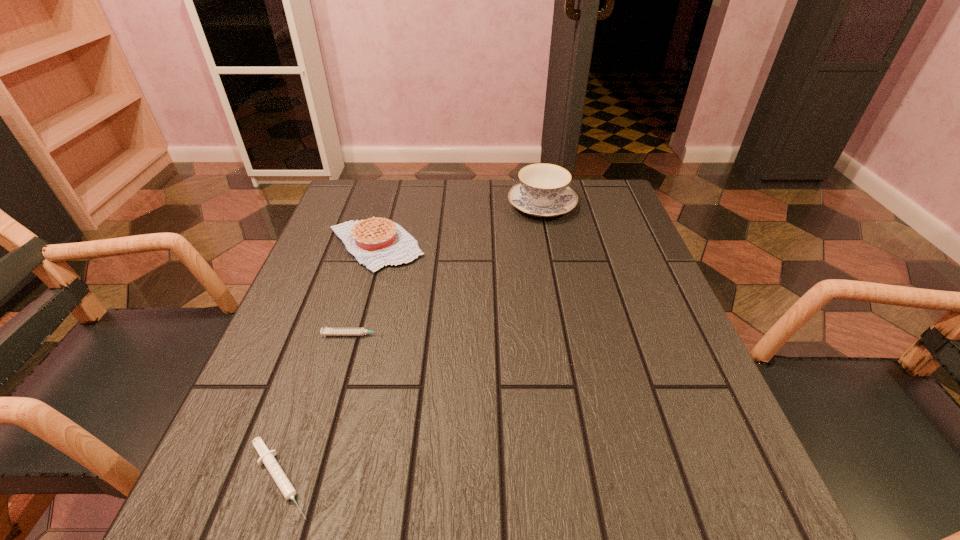
Where is `vacant space at the far left corner of the desktop`? The image size is (960, 540). vacant space at the far left corner of the desktop is located at coordinates (327, 220).

In the image, there is a desktop. At what (x,y) coordinates should I click in order to perform the action: click on blank space at the near left corner. Please return your answer as a coordinate pair (x, y). Looking at the image, I should click on (303, 509).

Locate an element on the screen. vacant space at the near right corner of the desktop is located at coordinates (677, 497).

Locate an element on the screen. This screenshot has height=540, width=960. vacant point located between the pie and the third farthest object is located at coordinates (365, 290).

The height and width of the screenshot is (540, 960). I want to click on free space between the rightmost object and the third shortest object, so click(x=459, y=225).

I want to click on vacant area that lies between the pie and the nearer syringe, so click(x=327, y=362).

Locate an element on the screen. The image size is (960, 540). vacant point located between the nearest object and the rightmost object is located at coordinates (411, 342).

At what (x,y) coordinates should I click in order to perform the action: click on free space that is in between the rightmost object and the second nearest object. Please return your answer as a coordinate pair (x, y). Looking at the image, I should click on (448, 270).

This screenshot has height=540, width=960. Identify the location of vacant area that lies between the rightmost object and the farther syringe. (448, 270).

What are the coordinates of `free space between the nearer syringe and the second nearest object` in the screenshot? It's located at (318, 407).